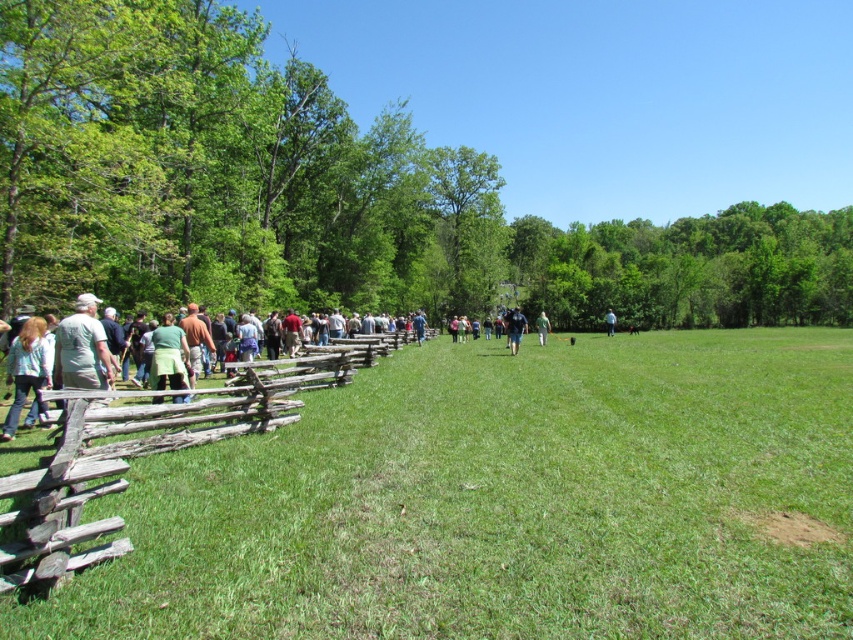
Does green fabric apron at center appear under light blue fabric at center?

Yes, green fabric apron at center is below light blue fabric at center.

Which is in front, point (169, 353) or point (608, 310)?

Point (169, 353) is in front.

The height and width of the screenshot is (640, 853). What are the coordinates of `green fabric apron at center` in the screenshot? It's located at (167, 355).

Does green fabric shirt at left appear under dark blue fabric at center?

Indeed, green fabric shirt at left is positioned under dark blue fabric at center.

Which is in front, point (166, 337) or point (519, 314)?

Positioned in front is point (166, 337).

At what (x,y) coordinates should I click in order to perform the action: click on green fabric shirt at left. Please return your answer as a coordinate pair (x, y). The image size is (853, 640). Looking at the image, I should click on (207, 388).

Which is behind, point (62, 426) or point (543, 316)?

The point (543, 316) is more distant.

Who is more forward, (291, 403) or (543, 323)?

Point (291, 403) is in front.

Is point (245, 380) positioned before point (543, 336)?

Yes, it is in front of point (543, 336).

This screenshot has width=853, height=640. Find the location of `weathered wood fence at left`. weathered wood fence at left is located at coordinates [x=146, y=451].